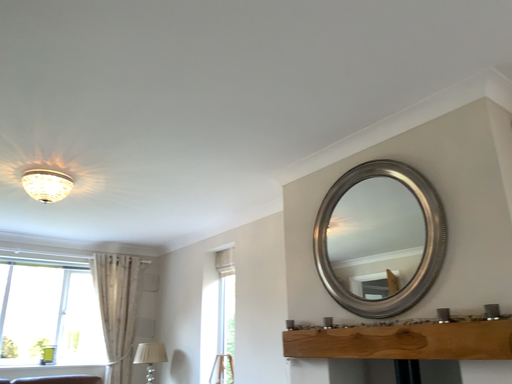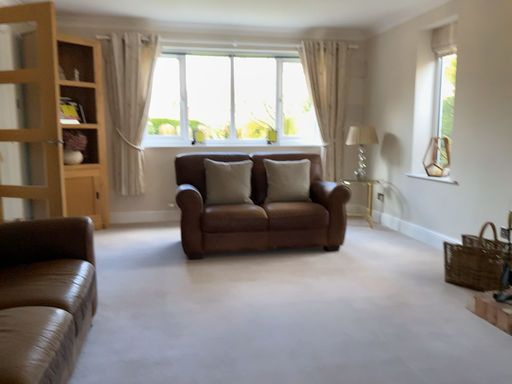
Question: Which way did the camera rotate in the video?

Choices:
 (A) rotated left
 (B) rotated right

Answer: (A)